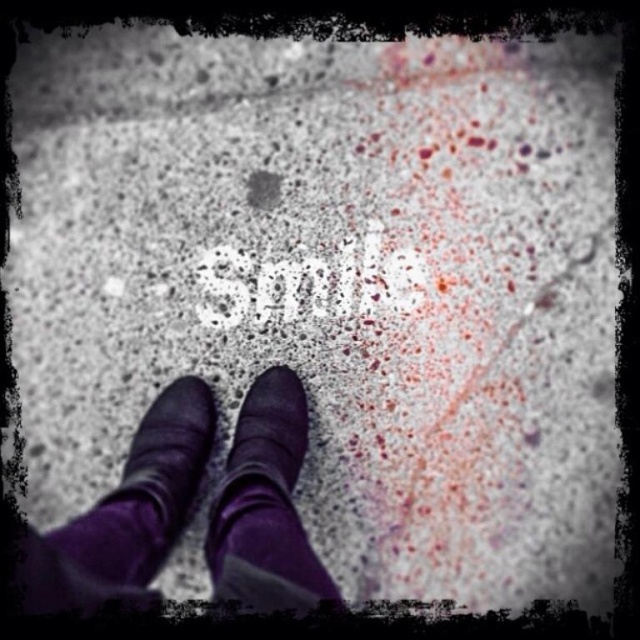
You are a detective examining the scene. You notice two purple suede boots at center and a purple suede boot at lower center. Which boot is taller?

The purple suede boots at center is taller than the purple suede boot at lower center.

You are a detective examining the scene. You notice the purple suede sock at center and the purple suede boot at lower center. Which object is positioned to the right of the other?

The purple suede sock at center is to the right of the purple suede boot at lower center.

You are a detective examining the scene. You notice the purple suede sock at center and the purple suede boot at lower center. How far apart are these two items?

The purple suede sock at center is 5.32 inches away from the purple suede boot at lower center.